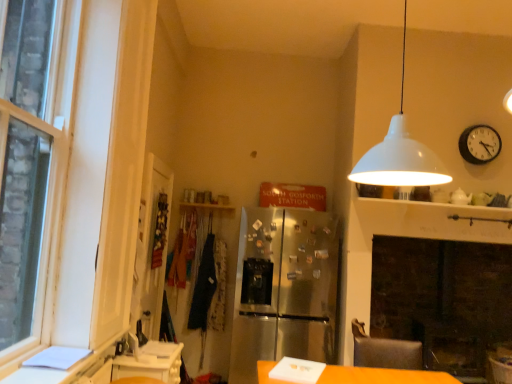
Question: From a real-world perspective, is leather-like swivel chair at lower right physically below stainless steel refrigerator at center?

Choices:
 (A) yes
 (B) no

Answer: (A)

Question: Does leather-like swivel chair at lower right appear on the left side of stainless steel refrigerator at center?

Choices:
 (A) no
 (B) yes

Answer: (A)

Question: Is leather-like swivel chair at lower right wider than stainless steel refrigerator at center?

Choices:
 (A) yes
 (B) no

Answer: (B)

Question: Considering the relative sizes of leather-like swivel chair at lower right and stainless steel refrigerator at center in the image provided, is leather-like swivel chair at lower right thinner than stainless steel refrigerator at center?

Choices:
 (A) yes
 (B) no

Answer: (A)

Question: From a real-world perspective, is leather-like swivel chair at lower right located higher than stainless steel refrigerator at center?

Choices:
 (A) no
 (B) yes

Answer: (A)

Question: Could you tell me if leather-like swivel chair at lower right is turned towards stainless steel refrigerator at center?

Choices:
 (A) yes
 (B) no

Answer: (B)

Question: Does white glossy counter at lower left have a smaller size compared to clear glass door at left?

Choices:
 (A) yes
 (B) no

Answer: (A)

Question: Can you confirm if white glossy counter at lower left is shorter than clear glass door at left?

Choices:
 (A) no
 (B) yes

Answer: (B)

Question: From the image's perspective, does white glossy counter at lower left appear lower than clear glass door at left?

Choices:
 (A) yes
 (B) no

Answer: (A)

Question: Is clear glass door at left at the back of white glossy counter at lower left?

Choices:
 (A) yes
 (B) no

Answer: (B)

Question: Is white glossy counter at lower left in contact with clear glass door at left?

Choices:
 (A) no
 (B) yes

Answer: (A)

Question: Are white glossy counter at lower left and clear glass door at left far apart?

Choices:
 (A) no
 (B) yes

Answer: (A)

Question: Can you confirm if leather-like swivel chair at lower right is thinner than dark blue fabric at center?

Choices:
 (A) yes
 (B) no

Answer: (B)